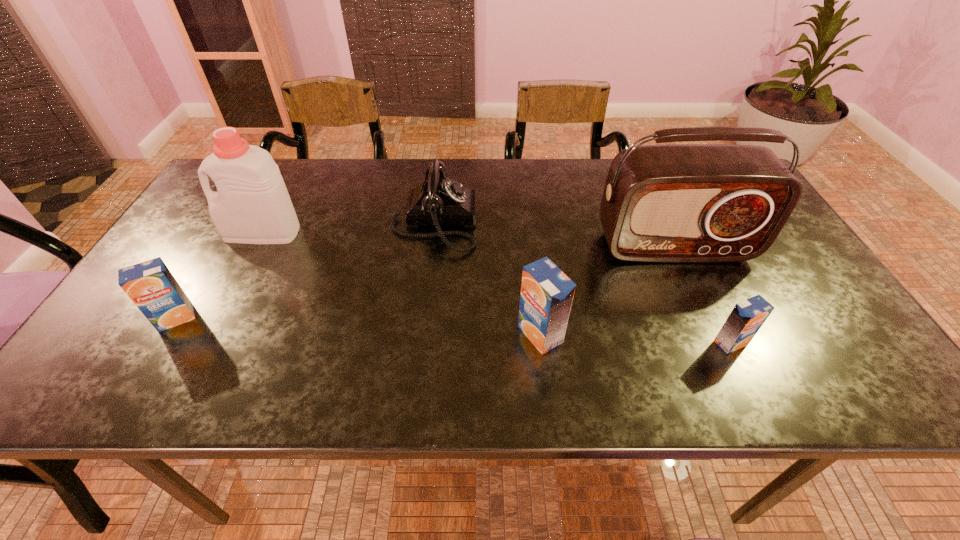
Identify the location of free spot located 0.060m on the left of the shortest object. (685, 343).

What are the coordinates of `vacant space situated 0.160m on the front panel of the radio receiver` in the screenshot? It's located at (706, 315).

Identify the location of free region located 0.310m on the dial of the telephone. The height and width of the screenshot is (540, 960). (589, 221).

Identify the location of free spot located 0.090m on the handle side of the detergent. Image resolution: width=960 pixels, height=540 pixels. pyautogui.click(x=193, y=233).

Find the location of a particular element. This screenshot has width=960, height=540. free space located 0.080m on the handle side of the detergent is located at coordinates (197, 233).

Locate an element on the screen. object that is at the far edge is located at coordinates (438, 201).

The image size is (960, 540). Identify the location of orange_juice positioned at the left edge. (151, 286).

Locate an element on the screen. The image size is (960, 540). detergent that is at the left edge is located at coordinates (252, 205).

This screenshot has height=540, width=960. I want to click on object present at the right edge, so click(x=674, y=203).

This screenshot has height=540, width=960. Identify the location of object that is at the near left corner. (151, 286).